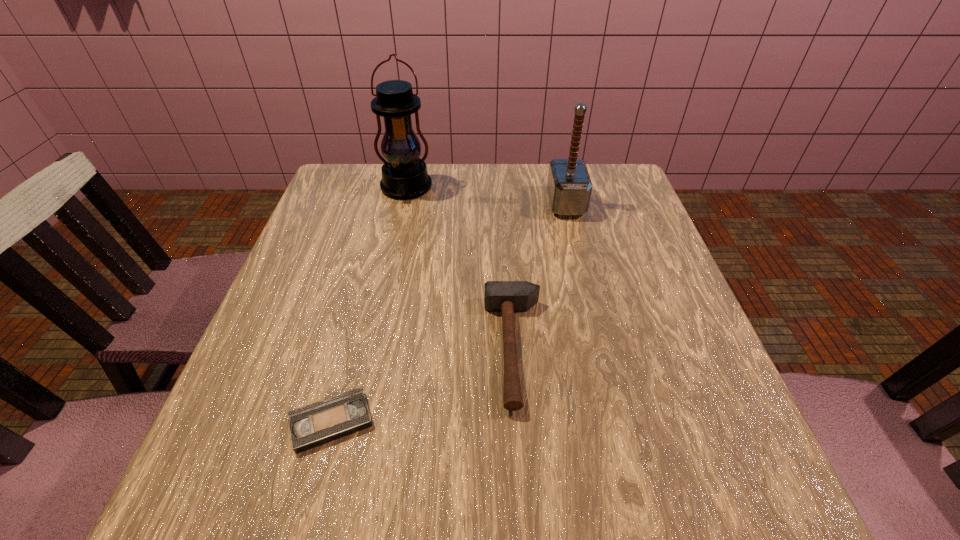
Where is `vacant space located on the striking surface of the second shortest object`? This screenshot has width=960, height=540. vacant space located on the striking surface of the second shortest object is located at coordinates (339, 348).

Where is `blank space located 0.190m on the back of the videotape`? The width and height of the screenshot is (960, 540). blank space located 0.190m on the back of the videotape is located at coordinates (361, 308).

The height and width of the screenshot is (540, 960). What are the coordinates of `lantern that is at the far edge` in the screenshot? It's located at (404, 175).

Identify the location of hammer that is at the far edge. The width and height of the screenshot is (960, 540). (569, 186).

Identify the location of object that is at the near edge. The height and width of the screenshot is (540, 960). (321, 422).

Image resolution: width=960 pixels, height=540 pixels. Find the location of `lantern situated at the left edge`. lantern situated at the left edge is located at coordinates (404, 175).

You are a GUI agent. You are given a task and a screenshot of the screen. Output one action in this format:
    pyautogui.click(x=<x>, y=<y>)
    Task: Click on the videotape at the left edge
    The width and height of the screenshot is (960, 540).
    Given the screenshot: What is the action you would take?
    pyautogui.click(x=321, y=422)

Identify the location of object that is at the right edge. Image resolution: width=960 pixels, height=540 pixels. (569, 186).

Locate an element on the screen. object located at the far left corner is located at coordinates (404, 175).

The height and width of the screenshot is (540, 960). In order to click on object present at the near left corner in this screenshot , I will do `click(321, 422)`.